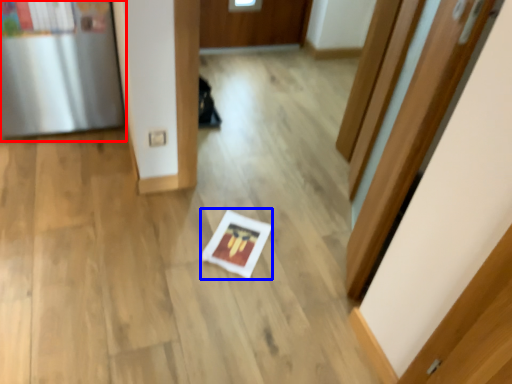
Question: Which object is further to the camera taking this photo, fridge (highlighted by a red box) or copy (highlighted by a blue box)?

Choices:
 (A) fridge
 (B) copy

Answer: (B)